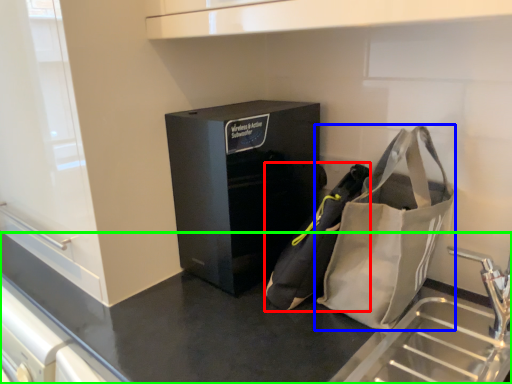
Question: Which object is positioned farthest from pouch (highlighted by a red box)? Select from handbag (highlighted by a blue box) and counter (highlighted by a green box).

Choices:
 (A) handbag
 (B) counter

Answer: (B)